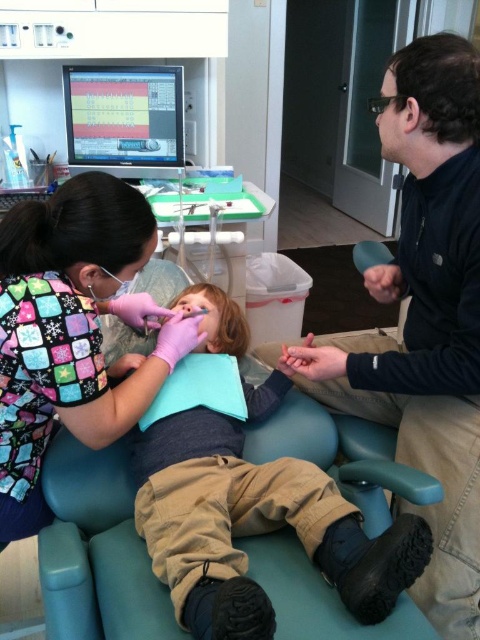
From the picture: Who is positioned more to the left, matte black jacket at upper right or multicolored scrubs at center?

From the viewer's perspective, multicolored scrubs at center appears more on the left side.

Between point (365, 358) and point (81, 214), which one is positioned in front?

Point (81, 214)

Where is `matte black jacket at upper right`? The width and height of the screenshot is (480, 640). matte black jacket at upper right is located at coordinates (425, 314).

Does multicolored scrubs at center have a lesser width compared to matte plastic monitor at upper center?

Yes.

The height and width of the screenshot is (640, 480). Describe the element at coordinates (69, 332) in the screenshot. I see `multicolored scrubs at center` at that location.

Where is `multicolored scrubs at center`? multicolored scrubs at center is located at coordinates (69, 332).

This screenshot has height=640, width=480. I want to click on multicolored scrubs at center, so click(x=69, y=332).

Image resolution: width=480 pixels, height=640 pixels. What are the coordinates of `matte blue pillow at center` in the screenshot? It's located at (254, 522).

Is matte blue pillow at center taller than multicolored scrubs at center?

No, matte blue pillow at center is not taller than multicolored scrubs at center.

Does point (312, 508) lie in front of point (91, 227)?

That is True.

Where is `matte blue pillow at center`? Image resolution: width=480 pixels, height=640 pixels. matte blue pillow at center is located at coordinates (254, 522).